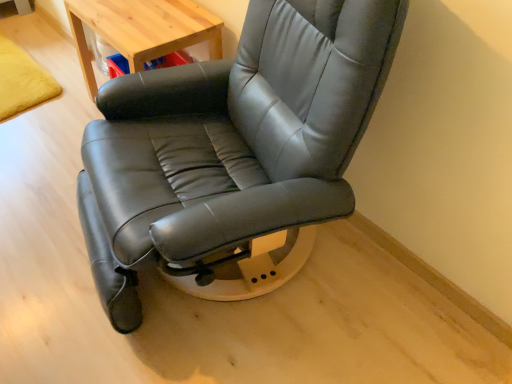
This screenshot has height=384, width=512. What do you see at coordinates (142, 30) in the screenshot?
I see `light wood table at upper left` at bounding box center [142, 30].

What is the approximate width of light wood table at upper left?

It is 15.90 inches.

At what (x,y) coordinates should I click in order to perform the action: click on light wood table at upper left. Please return your answer as a coordinate pair (x, y). Image resolution: width=512 pixels, height=384 pixels. Looking at the image, I should click on (142, 30).

The width and height of the screenshot is (512, 384). I want to click on black leather chair at center, so click(233, 150).

Describe the element at coordinates (233, 150) in the screenshot. This screenshot has width=512, height=384. I see `black leather chair at center` at that location.

Find the location of a particular element. The height and width of the screenshot is (384, 512). light wood table at upper left is located at coordinates [x=142, y=30].

Is light wood table at upper left at the left side of black leather chair at center?

Yes.

Which object is further away from the camera, light wood table at upper left or black leather chair at center?

light wood table at upper left is further from the camera.

Which is in front, point (177, 42) or point (173, 190)?

The point (173, 190) is more forward.

From the image's perspective, is light wood table at upper left beneath black leather chair at center?

No, from the image's perspective, light wood table at upper left is not beneath black leather chair at center.

From a real-world perspective, who is located lower, light wood table at upper left or black leather chair at center?

light wood table at upper left, from a real-world perspective.

Can you confirm if light wood table at upper left is wider than black leather chair at center?

Incorrect, the width of light wood table at upper left does not surpass that of black leather chair at center.

Considering the sizes of objects light wood table at upper left and black leather chair at center in the image provided, who is shorter, light wood table at upper left or black leather chair at center?

light wood table at upper left.

Based on their sizes in the image, would you say light wood table at upper left is bigger or smaller than black leather chair at center?

In the image, light wood table at upper left appears to be smaller than black leather chair at center.

Is light wood table at upper left spatially inside black leather chair at center, or outside of it?

The correct answer is: outside.

Are light wood table at upper left and black leather chair at center beside each other?

No, light wood table at upper left is not next to black leather chair at center.

Is light wood table at upper left positioned with its back to black leather chair at center?

No, light wood table at upper left's orientation is not away from black leather chair at center.

How many degrees apart are the facing directions of light wood table at upper left and black leather chair at center?

The angular difference between light wood table at upper left and black leather chair at center is 15.5 degrees.

Where is `table that appears below the black leather chair at center (from a real-world perspective)`? table that appears below the black leather chair at center (from a real-world perspective) is located at coordinates (142, 30).

Based on the photo, considering the relative positions of black leather chair at center and light wood table at upper left in the image provided, is black leather chair at center to the right of light wood table at upper left from the viewer's perspective?

Indeed, black leather chair at center is positioned on the right side of light wood table at upper left.

Looking at this image, which object is closer to the camera, black leather chair at center or light wood table at upper left?

black leather chair at center is closer to the camera.

Which is less distant, (244, 238) or (198, 5)?

Point (244, 238) is closer to the camera than point (198, 5).

From the image's perspective, which one is positioned higher, black leather chair at center or light wood table at upper left?

light wood table at upper left is shown above in the image.

From a real-world perspective, relative to light wood table at upper left, is black leather chair at center vertically above or below?

From a real-world perspective, black leather chair at center is physically above light wood table at upper left.

Considering the sizes of objects black leather chair at center and light wood table at upper left in the image provided, who is thinner, black leather chair at center or light wood table at upper left?

With smaller width is light wood table at upper left.

Considering the relative sizes of black leather chair at center and light wood table at upper left in the image provided, is black leather chair at center shorter than light wood table at upper left?

No, black leather chair at center is not shorter than light wood table at upper left.

Considering the sizes of objects black leather chair at center and light wood table at upper left in the image provided, who is bigger, black leather chair at center or light wood table at upper left?

Bigger between the two is black leather chair at center.

Is black leather chair at center not within light wood table at upper left?

Absolutely, black leather chair at center is external to light wood table at upper left.

Would you consider black leather chair at center to be distant from light wood table at upper left?

Actually, black leather chair at center and light wood table at upper left are a little close together.

Is black leather chair at center facing away from light wood table at upper left?

black leather chair at center is not turned away from light wood table at upper left.

Locate an element on the screen. The width and height of the screenshot is (512, 384). table above the black leather chair at center (from the image's perspective) is located at coordinates (142, 30).

You are a GUI agent. You are given a task and a screenshot of the screen. Output one action in this format:
    pyautogui.click(x=<x>, y=<y>)
    Task: Click on the chair below the light wood table at upper left (from the image's perspective)
    This screenshot has width=512, height=384.
    Given the screenshot: What is the action you would take?
    pyautogui.click(x=233, y=150)

You are a GUI agent. You are given a task and a screenshot of the screen. Output one action in this format:
    pyautogui.click(x=<x>, y=<y>)
    Task: Click on the table below the black leather chair at center (from a real-world perspective)
    The width and height of the screenshot is (512, 384).
    Given the screenshot: What is the action you would take?
    pyautogui.click(x=142, y=30)